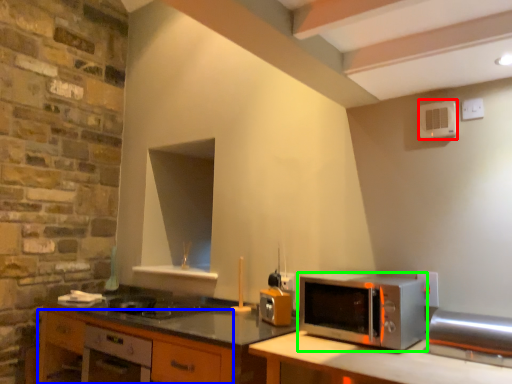
Question: Estimate the real-world distances between objects in this image. Which object is farther from appliance (highlighted by a red box), cabinetry (highlighted by a blue box) or microwave oven (highlighted by a green box)?

Choices:
 (A) cabinetry
 (B) microwave oven

Answer: (A)